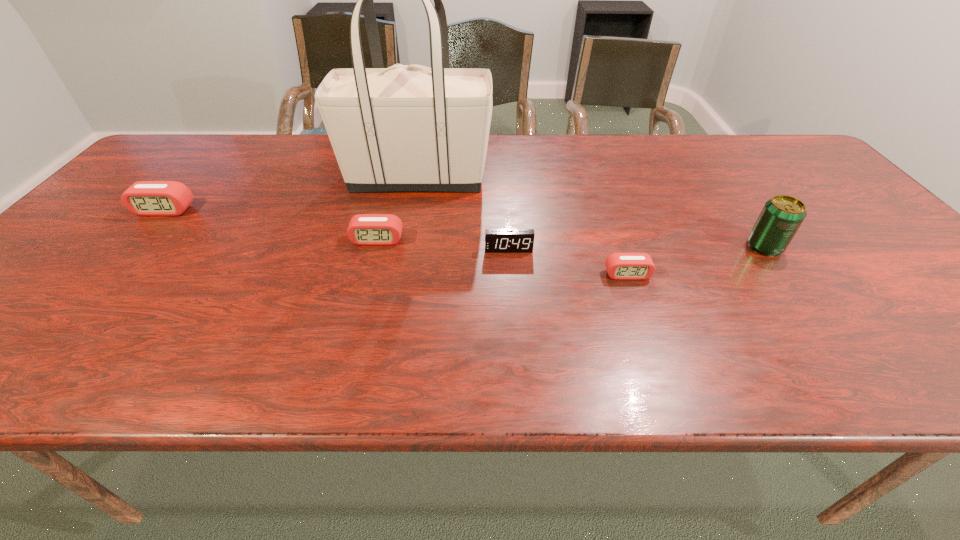
In order to click on empty space between the second alarm clock from right to left and the shortest alarm clock in this screenshot , I will do `click(568, 262)`.

The image size is (960, 540). Identify the location of object that stands as the second closest to the second alarm clock from left to right. (x=496, y=240).

Identify which object is the nearest to the farthest alarm clock. Please provide its 2D coordinates. Your answer should be formatted as a tuple, i.e. [(x, y)], where the tuple contains the x and y coordinates of a point satisfying the conditions above.

[(412, 128)]

Select which alarm clock appears as the closest to the second alarm clock from right to left. Please provide its 2D coordinates. Your answer should be formatted as a tuple, i.e. [(x, y)], where the tuple contains the x and y coordinates of a point satisfying the conditions above.

[(620, 266)]

Identify which alarm clock is the closest to the third alarm clock from left to right. Please provide its 2D coordinates. Your answer should be formatted as a tuple, i.e. [(x, y)], where the tuple contains the x and y coordinates of a point satisfying the conditions above.

[(620, 266)]

I want to click on vacant space that satisfies the following two spatial constraints: 1. with handles facing forward on the farthest object; 2. on the front-facing side of the second alarm clock from left to right, so click(x=405, y=240).

The height and width of the screenshot is (540, 960). Find the location of `vacant position in the image that satisfies the following two spatial constraints: 1. on the back side of the fifth shortest object; 2. with handles facing forward on the farthest object`. vacant position in the image that satisfies the following two spatial constraints: 1. on the back side of the fifth shortest object; 2. with handles facing forward on the farthest object is located at coordinates (715, 178).

Where is `vacant region that satisfies the following two spatial constraints: 1. with handles facing forward on the rightmost object; 2. on the right side of the shopping bag`? The image size is (960, 540). vacant region that satisfies the following two spatial constraints: 1. with handles facing forward on the rightmost object; 2. on the right side of the shopping bag is located at coordinates (404, 247).

Identify the location of vacant space that satisfies the following two spatial constraints: 1. on the front-facing side of the second farthest object; 2. on the right side of the second tallest object. (132, 247).

Where is `vacant space that satisfies the following two spatial constraints: 1. on the front-facing side of the leftmost object; 2. on the left side of the beer can`? The image size is (960, 540). vacant space that satisfies the following two spatial constraints: 1. on the front-facing side of the leftmost object; 2. on the left side of the beer can is located at coordinates (132, 247).